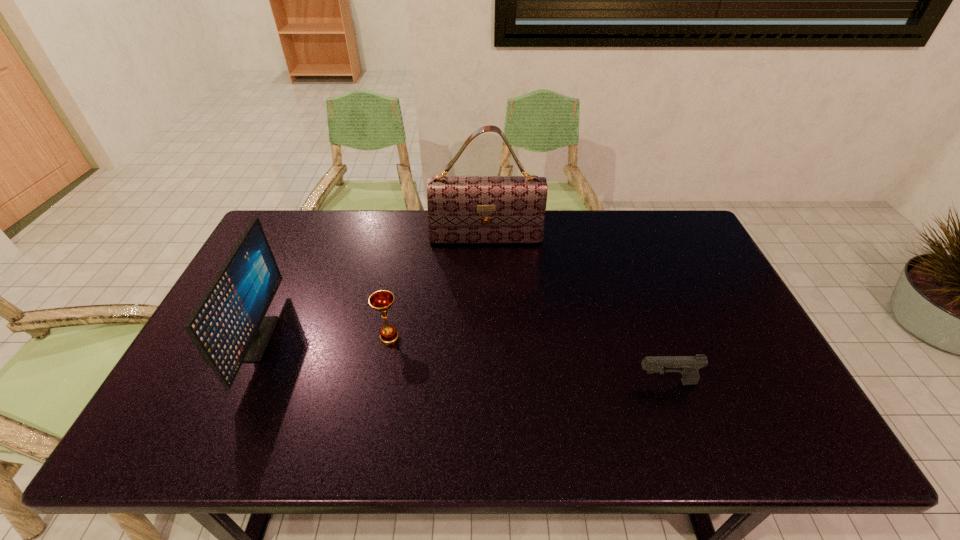
Locate an element on the screen. The height and width of the screenshot is (540, 960). free spot between the computer monitor and the shortest object is located at coordinates (461, 361).

Identify which object is the second closest to the pistol. Please provide its 2D coordinates. Your answer should be formatted as a tuple, i.e. [(x, y)], where the tuple contains the x and y coordinates of a point satisfying the conditions above.

[(382, 300)]

The height and width of the screenshot is (540, 960). Find the location of `object identified as the closest to the rightmost object`. object identified as the closest to the rightmost object is located at coordinates (461, 209).

The width and height of the screenshot is (960, 540). I want to click on blank space that satisfies the following two spatial constraints: 1. on the front of the handbag with the clasp; 2. on the screen side of the leftmost object, so click(x=488, y=339).

You are a GUI agent. You are given a task and a screenshot of the screen. Output one action in this format:
    pyautogui.click(x=<x>, y=<y>)
    Task: Click on the vacant area in the image that satisfies the following two spatial constraints: 1. on the front side of the second object from left to right; 2. on the screen side of the computer monitor
    The width and height of the screenshot is (960, 540).
    Given the screenshot: What is the action you would take?
    pyautogui.click(x=389, y=339)

You are a GUI agent. You are given a task and a screenshot of the screen. Output one action in this format:
    pyautogui.click(x=<x>, y=<y>)
    Task: Click on the vacant space that satisfies the following two spatial constraints: 1. on the front of the handbag with the clasp; 2. on the screen side of the leftmost object
    The height and width of the screenshot is (540, 960).
    Given the screenshot: What is the action you would take?
    pyautogui.click(x=488, y=339)